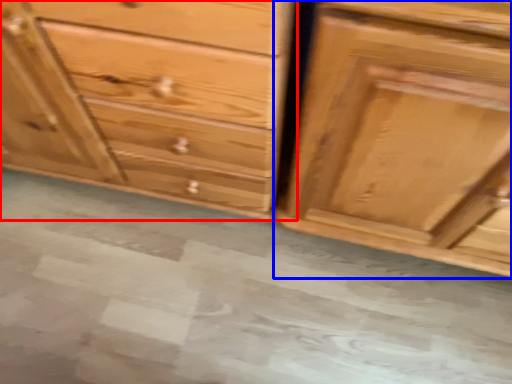
Question: Which object is further to the camera taking this photo, chest of drawers (highlighted by a red box) or chest of drawers (highlighted by a blue box)?

Choices:
 (A) chest of drawers
 (B) chest of drawers

Answer: (A)